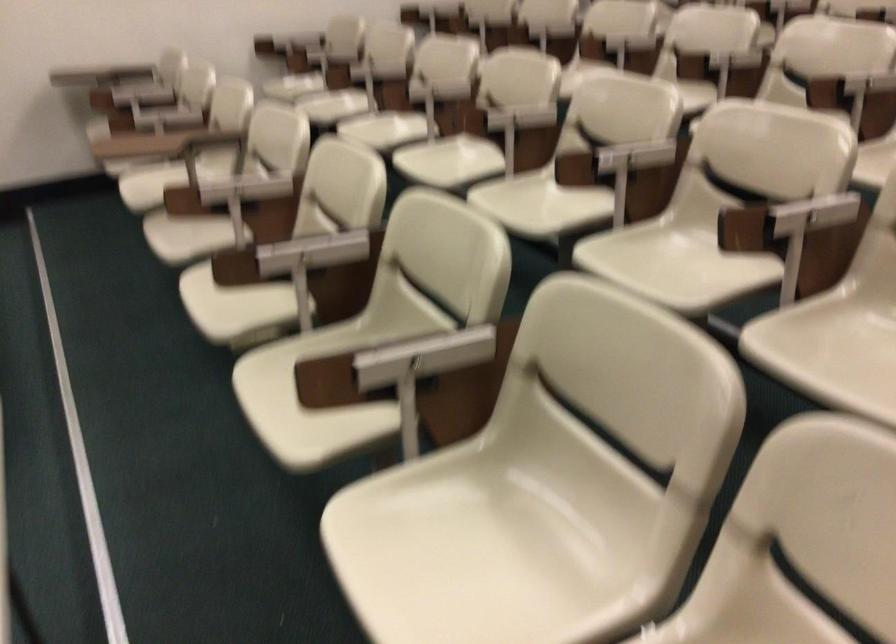
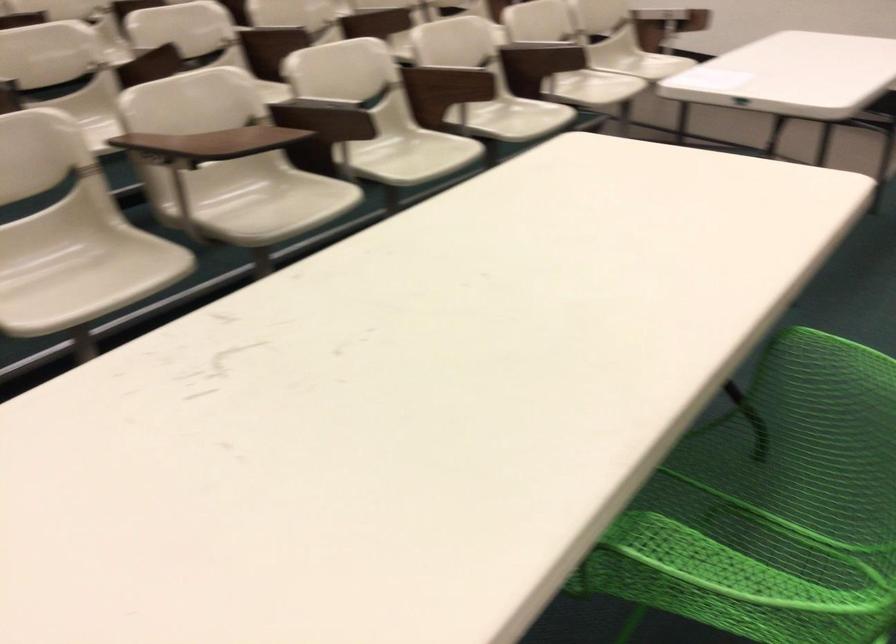
Question: I am providing you with two images of the same scene from different viewpoints. Which of the following objects are not visible in image2?

Choices:
 (A) green chair armrest
 (B) yellow stuffed pillow
 (C) wooden chair armrest
 (D) white chair sitting surface

Answer: (D)